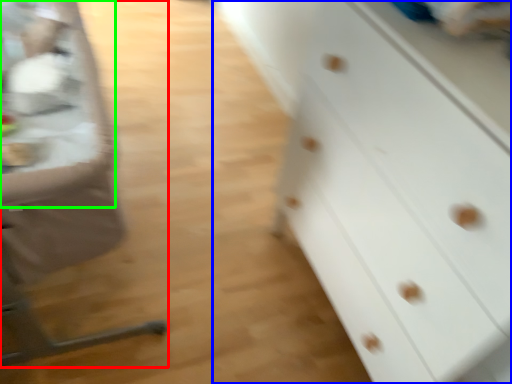
Question: Estimate the real-world distances between objects in this image. Which object is closer to feeding chair (highlighted by a red box), chest of drawers (highlighted by a blue box) or table (highlighted by a green box)?

Choices:
 (A) chest of drawers
 (B) table

Answer: (B)